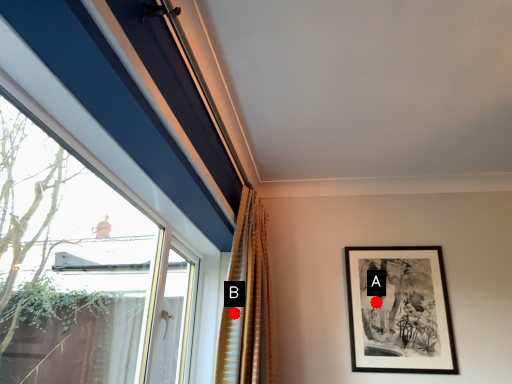
Question: Two points are circled on the image, labeled by A and B beside each circle. Which point is closer to the camera?

Choices:
 (A) A is closer
 (B) B is closer

Answer: (B)